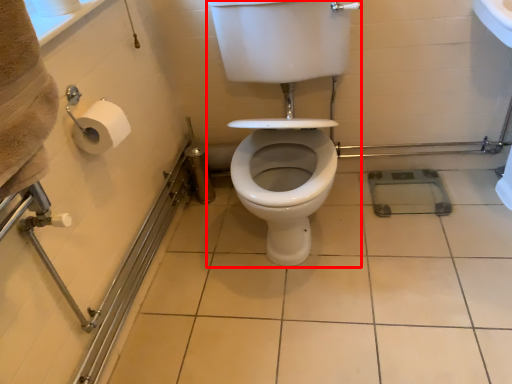
Question: From the image's perspective, where is sit (annotated by the red box) located relative to ceramic tile?

Choices:
 (A) above
 (B) below

Answer: (A)